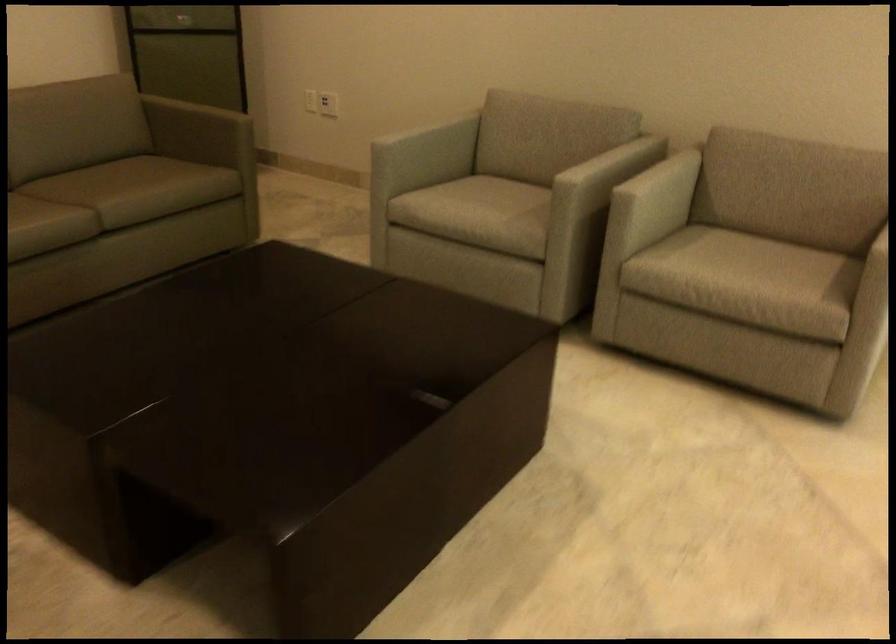
What do you see at coordinates (227, 114) in the screenshot? This screenshot has height=644, width=896. I see `the green sofa armrest` at bounding box center [227, 114].